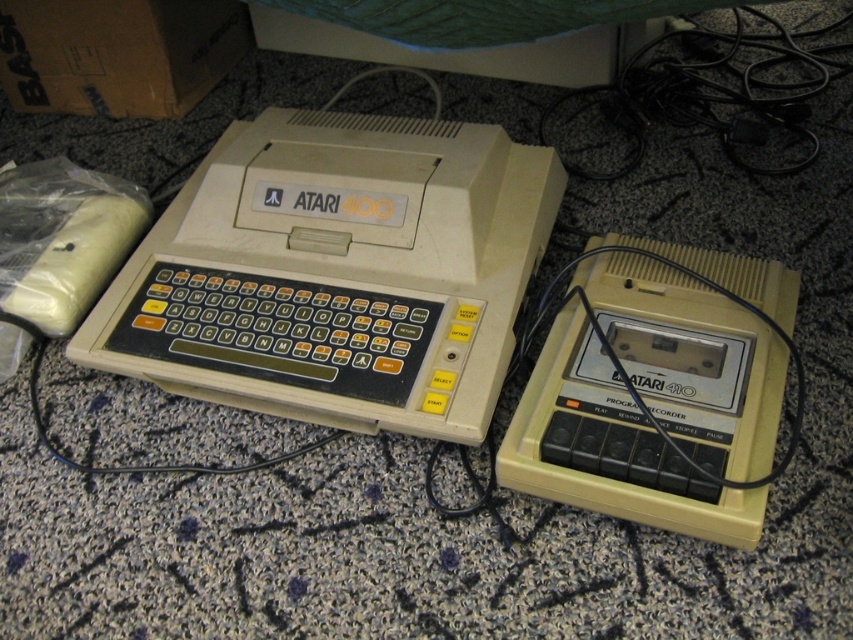
From the picture: You are setting up a retro gaming station and need to place the beige plastic atari 400 at center and the beige plastic atari 410 at right on a shelf. If the shelf has enough space, which device should you place first to ensure they are positioned correctly according to their current arrangement?

You should place the beige plastic atari 400 at center first because it is to the left of the beige plastic atari 410 at right, so positioning it first ensures there is space for the other device to the right.

You are a technician inspecting two vintage Atari devices. You need to reach both the beige plastic atari 400 at center and the beige plastic atari 410 at right. Which device will you need to step forward more to reach?

The beige plastic atari 410 at right is further away from you than the beige plastic atari 400 at center, so you will need to step forward more to reach the beige plastic atari 410 at right.